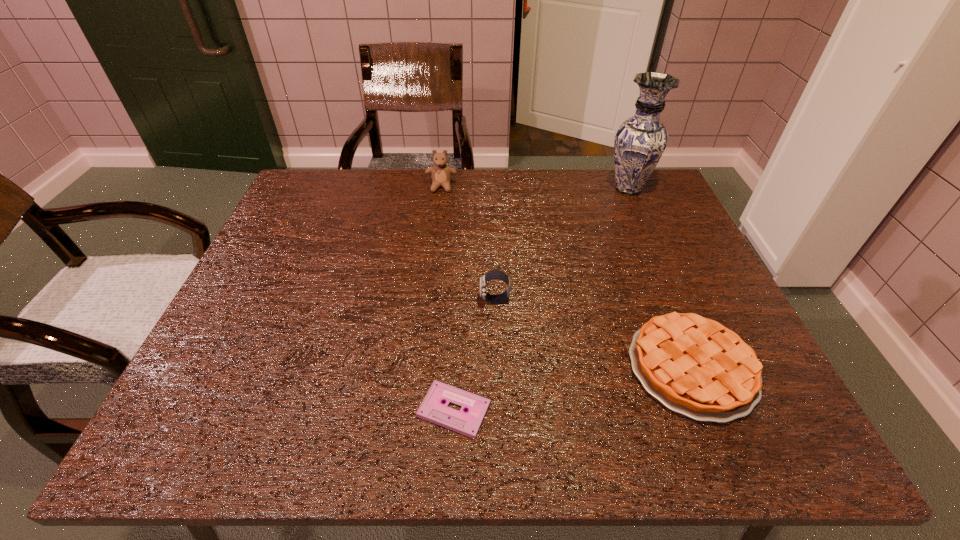
The width and height of the screenshot is (960, 540). Identify the location of vacant space that is in between the fourth tallest object and the teddy bear. (566, 277).

This screenshot has height=540, width=960. Find the location of `free spot between the tallest object and the videotape`. free spot between the tallest object and the videotape is located at coordinates (541, 299).

What are the coordinates of `unoccupied position between the second shortest object and the teddy bear` in the screenshot? It's located at (566, 277).

The width and height of the screenshot is (960, 540). Identify the location of vacant area between the tallest object and the teddy bear. (535, 188).

Locate an element on the screen. empty location between the tallest object and the teddy bear is located at coordinates point(535,188).

Where is `free space that is in between the teddy bear and the tallest object`? The width and height of the screenshot is (960, 540). free space that is in between the teddy bear and the tallest object is located at coordinates (535, 188).

Image resolution: width=960 pixels, height=540 pixels. What are the coordinates of `vacant space that is in between the teddy bear and the pie` in the screenshot? It's located at (566, 277).

At what (x,y) coordinates should I click in order to perform the action: click on the second closest object to the fourth tallest object. Please return your answer as a coordinate pair (x, y). The image size is (960, 540). Looking at the image, I should click on (432, 408).

Identify which object is the closest to the shortest object. Please provide its 2D coordinates. Your answer should be formatted as a tuple, i.e. [(x, y)], where the tuple contains the x and y coordinates of a point satisfying the conditions above.

[(494, 274)]

The height and width of the screenshot is (540, 960). I want to click on vacant region that satisfies the following two spatial constraints: 1. on the back side of the vase; 2. on the left side of the pie, so click(618, 188).